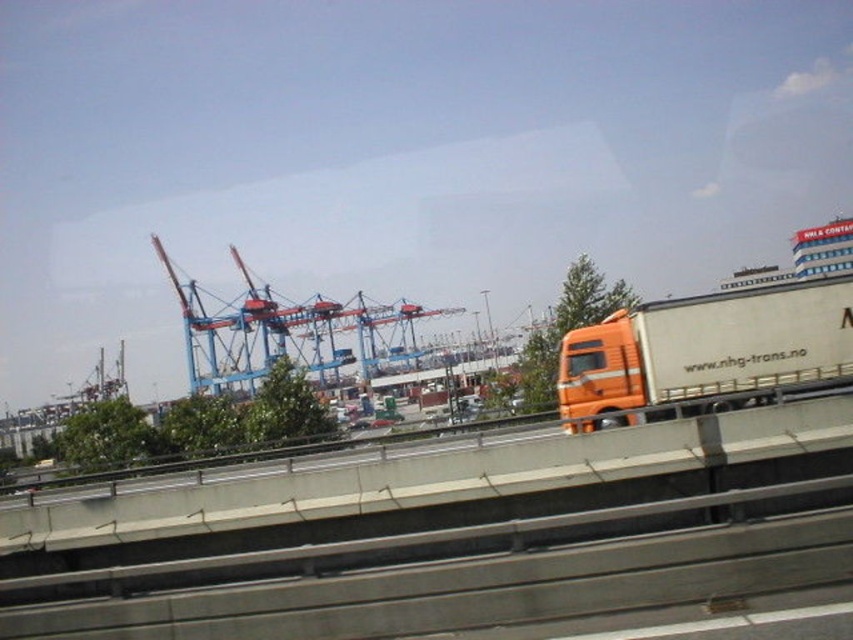
You are a delivery driver who needs to park your orange matte trailer truck at right in the parking lot. The parking spot is exactly the size of the concrete at center. Will your truck fit in the parking spot?

The concrete at center is bigger than orange matte trailer truck at right, so the parking spot is larger than the truck, meaning the truck will fit in the parking spot.

You are a delivery driver approaching the concrete at center and the orange matte trailer truck at right. Which object will you encounter first?

The concrete at center is closer to the viewer than the orange matte trailer truck at right, so you will encounter the concrete at center first.

You are a delivery driver who needs to park the orange matte trailer truck at right precisely 10 meters away from the concrete at center. Based on the scene, can you park the truck at the desired distance?

The concrete at center is 10.33 meters from the orange matte trailer truck at right. Since the required distance is 10 meters, the truck is already parked slightly beyond the desired distance by 0.33 meters.